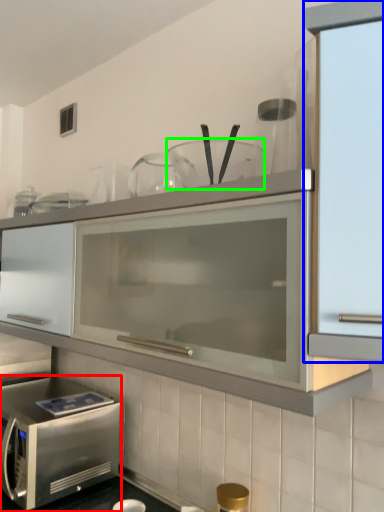
Question: Which object is the farthest from microwave oven (highlighted by a red box)? Choose among these: cabinetry (highlighted by a blue box) or tableware (highlighted by a green box).

Choices:
 (A) cabinetry
 (B) tableware

Answer: (A)